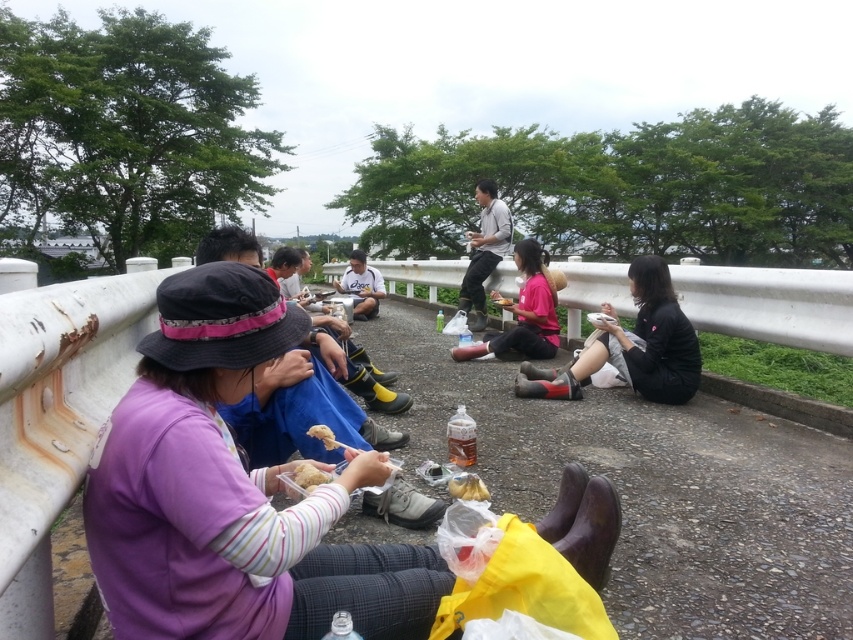
You are a photographer trying to capture a candid shot of the people on the bridge. You notice the pink matte shirt at center and the light brown leather jacket at center. Which one is positioned lower in the image?

The pink matte shirt at center is located below light brown leather jacket at center, so the pink matte shirt at center is positioned lower in the image.

You are standing at the origin point of the coordinate system in this scene. You need to place a new red marker at the location of the yellow paper bag at center. What are the coordinates where you should place the red marker?

The coordinates for the yellow paper bag at center are at point (x=467, y=486), so you should place the red marker at those coordinates.

You are standing at the position of the person in the purple jacket and wide brimmed black hat with pink trim. You want to move towards the point that is behind you. Which point should you move towards, point (212, 276) or point (312, 435)?

Point (312, 435) is behind the person in the purple jacket and wide brimmed black hat with pink trim, so you should move towards point (312, 435).